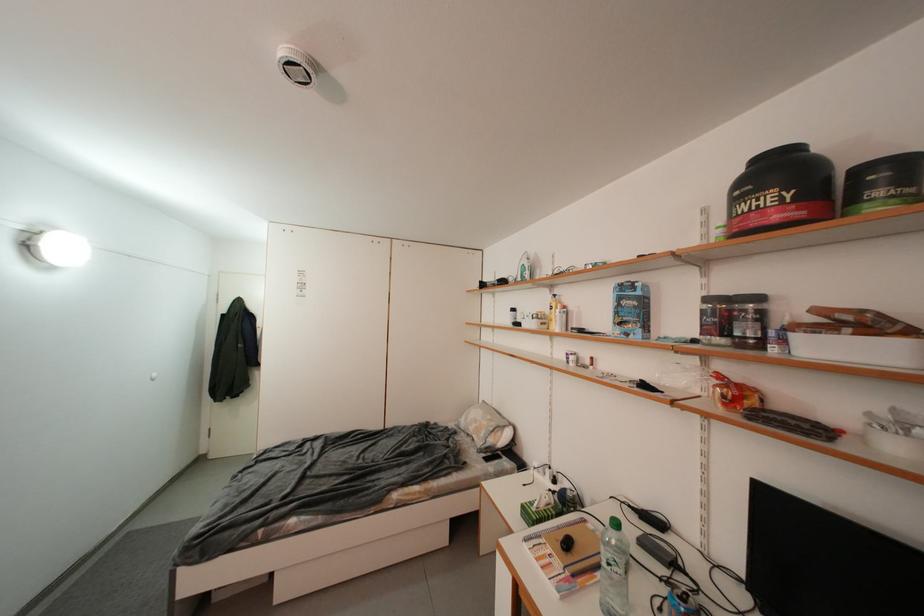
What are the coordinates of `green tissue box` in the screenshot? It's located at [x=550, y=506].